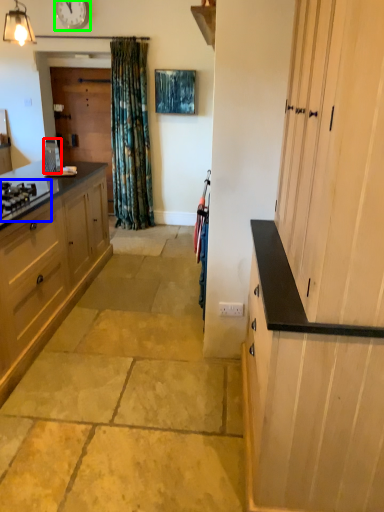
Question: Which is nearer to the appliance (highlighted by a red box)? gas stove (highlighted by a blue box) or clock (highlighted by a green box).

Choices:
 (A) gas stove
 (B) clock

Answer: (A)